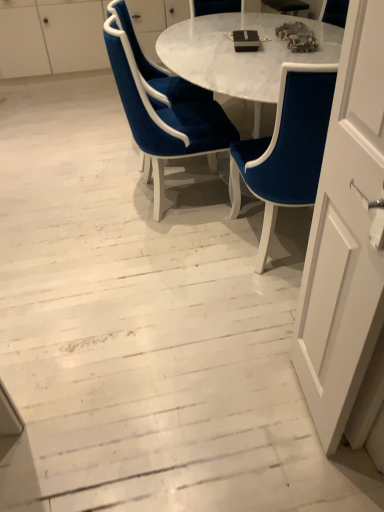
Describe the element at coordinates (286, 148) in the screenshot. Image resolution: width=384 pixels, height=512 pixels. I see `velvet blue chair at center, the 3th chair from the left` at that location.

What do you see at coordinates (164, 117) in the screenshot? I see `velvet blue chair at center, acting as the 2th chair starting from the right` at bounding box center [164, 117].

What is the approximate height of velvet blue chair at center, which appears as the 2th chair when viewed from the left?

36.64 inches.

Identify the location of velvet blue chair at center, the 3th chair from the left. The image size is (384, 512). (286, 148).

Image resolution: width=384 pixels, height=512 pixels. In order to click on dresser above the velvet blue chair at center, the first chair positioned from the left (from the image's perspective) in this screenshot , I will do `click(51, 37)`.

In terms of size, does white glossy dresser at upper center appear bigger or smaller than velvet blue chair at center, arranged as the 3th chair when viewed from the right?

white glossy dresser at upper center is bigger than velvet blue chair at center, arranged as the 3th chair when viewed from the right.

From a real-world perspective, is white glossy dresser at upper center physically above velvet blue chair at center, the first chair positioned from the left?

No, from a real-world perspective, white glossy dresser at upper center is not over velvet blue chair at center, the first chair positioned from the left

Is white glossy dresser at upper center with velvet blue chair at center, arranged as the 3th chair when viewed from the right?

No, white glossy dresser at upper center is not beside velvet blue chair at center, arranged as the 3th chair when viewed from the right.

Considering the positions of point (293, 150) and point (68, 44), is point (293, 150) closer or farther from the camera than point (68, 44)?

Point (293, 150).

From the image's perspective, which object appears higher, velvet blue chair at center, the 3th chair from the left, or white glossy dresser at upper center?

white glossy dresser at upper center, from the image's perspective.

Does velvet blue chair at center, the 3th chair from the left, touch white glossy dresser at upper center?

They are not placed beside each other.

From the image's perspective, which is below, velvet blue chair at center, the first chair positioned from the left, or velvet blue chair at center, which is the 1th chair from right to left?

From the image's view, velvet blue chair at center, which is the 1th chair from right to left, is below.

Is velvet blue chair at center, arranged as the 3th chair when viewed from the right, facing towards velvet blue chair at center, the 3th chair from the left?

No, velvet blue chair at center, arranged as the 3th chair when viewed from the right, is not aimed at velvet blue chair at center, the 3th chair from the left.

From a real-world perspective, is velvet blue chair at center, the first chair positioned from the left, physically located above or below velvet blue chair at center, the 3th chair from the left?

From a real-world perspective, velvet blue chair at center, the first chair positioned from the left, is physically below velvet blue chair at center, the 3th chair from the left.

Considering the relative positions of velvet blue chair at center, arranged as the 3th chair when viewed from the right, and velvet blue chair at center, which is the 1th chair from right to left, in the image provided, is velvet blue chair at center, arranged as the 3th chair when viewed from the right, in front of velvet blue chair at center, which is the 1th chair from right to left,?

No, the depth of velvet blue chair at center, arranged as the 3th chair when viewed from the right, is greater than that of velvet blue chair at center, which is the 1th chair from right to left.

Would you say velvet blue chair at center, which is the 1th chair from right to left, is a long distance from velvet blue chair at center, which appears as the 2th chair when viewed from the left?

That's not correct — velvet blue chair at center, which is the 1th chair from right to left, is a little close to velvet blue chair at center, which appears as the 2th chair when viewed from the left.

From a real-world perspective, relative to velvet blue chair at center, which appears as the 2th chair when viewed from the left, is velvet blue chair at center, the 3th chair from the left, vertically above or below?

velvet blue chair at center, the 3th chair from the left, is situated lower than velvet blue chair at center, which appears as the 2th chair when viewed from the left, in the real world.

Which is nearer, (249, 169) or (238, 138)?

The point (249, 169) is closer.

Between velvet blue chair at center, the 3th chair from the left, and velvet blue chair at center, acting as the 2th chair starting from the right, which one appears on the left side from the viewer's perspective?

velvet blue chair at center, acting as the 2th chair starting from the right.

Can you confirm if velvet blue chair at center, which appears as the 2th chair when viewed from the left, is positioned to the right of velvet blue chair at center, which is the 1th chair from right to left?

Incorrect, velvet blue chair at center, which appears as the 2th chair when viewed from the left, is not on the right side of velvet blue chair at center, which is the 1th chair from right to left.

Which of these two, velvet blue chair at center, which appears as the 2th chair when viewed from the left, or velvet blue chair at center, which is the 1th chair from right to left, stands taller?

velvet blue chair at center, which appears as the 2th chair when viewed from the left.

Is velvet blue chair at center, acting as the 2th chair starting from the right, looking in the opposite direction of velvet blue chair at center, the 3th chair from the left?

No, velvet blue chair at center, the 3th chair from the left, is not at the back of velvet blue chair at center, acting as the 2th chair starting from the right.

Does velvet blue chair at center, which appears as the 2th chair when viewed from the left, contain velvet blue chair at center, which is the 1th chair from right to left?

No.

In the scene shown: Considering the relative sizes of velvet blue chair at center, which appears as the 2th chair when viewed from the left, and white glossy dresser at upper center in the image provided, is velvet blue chair at center, which appears as the 2th chair when viewed from the left, thinner than white glossy dresser at upper center?

In fact, velvet blue chair at center, which appears as the 2th chair when viewed from the left, might be wider than white glossy dresser at upper center.

Is velvet blue chair at center, acting as the 2th chair starting from the right, taller or shorter than white glossy dresser at upper center?

velvet blue chair at center, acting as the 2th chair starting from the right, is taller than white glossy dresser at upper center.

Which of these two, velvet blue chair at center, which appears as the 2th chair when viewed from the left, or white glossy dresser at upper center, is bigger?

white glossy dresser at upper center.

From the image's perspective, is velvet blue chair at center, acting as the 2th chair starting from the right, located above or below white glossy dresser at upper center?

Clearly, from the image's perspective, velvet blue chair at center, acting as the 2th chair starting from the right, is below white glossy dresser at upper center.

Relative to velvet blue chair at center, the 3th chair from the left, is white glossy dresser at upper center in front or behind?

white glossy dresser at upper center is positioned farther from the viewer than velvet blue chair at center, the 3th chair from the left.

Is white glossy dresser at upper center located outside velvet blue chair at center, the 3th chair from the left?

Indeed, white glossy dresser at upper center is completely outside velvet blue chair at center, the 3th chair from the left.

Does white glossy dresser at upper center have a larger size compared to velvet blue chair at center, which is the 1th chair from right to left?

Yes, white glossy dresser at upper center is bigger than velvet blue chair at center, which is the 1th chair from right to left.

Find the location of a particular element. This screenshot has height=512, width=384. the 1st chair counting from the right of the white glossy dresser at upper center is located at coordinates (156, 68).

In the image, there is a velvet blue chair at center, the 3th chair from the left. Where is `dresser below it (from a real-world perspective)`? This screenshot has width=384, height=512. dresser below it (from a real-world perspective) is located at coordinates (51, 37).

From the image, which object appears to be farther from velvet blue chair at center, the first chair positioned from the left, velvet blue chair at center, which appears as the 2th chair when viewed from the left, or velvet blue chair at center, the 3th chair from the left?

velvet blue chair at center, the 3th chair from the left, is positioned further to the anchor velvet blue chair at center, the first chair positioned from the left.

Based on their spatial positions, is velvet blue chair at center, arranged as the 3th chair when viewed from the right, or velvet blue chair at center, which is the 1th chair from right to left, closer to white glossy dresser at upper center?

velvet blue chair at center, arranged as the 3th chair when viewed from the right.

When comparing their distances from velvet blue chair at center, which is the 1th chair from right to left, does velvet blue chair at center, the first chair positioned from the left, or white glossy dresser at upper center seem further?

Based on the image, white glossy dresser at upper center appears to be further to velvet blue chair at center, which is the 1th chair from right to left.

From the image, which object appears to be nearer to velvet blue chair at center, arranged as the 3th chair when viewed from the right, white glossy dresser at upper center or velvet blue chair at center, the 3th chair from the left?

velvet blue chair at center, the 3th chair from the left.

Based on their spatial positions, is velvet blue chair at center, acting as the 2th chair starting from the right, or white glossy dresser at upper center closer to velvet blue chair at center, which is the 1th chair from right to left?

Based on the image, velvet blue chair at center, acting as the 2th chair starting from the right, appears to be nearer to velvet blue chair at center, which is the 1th chair from right to left.

Based on their spatial positions, is white glossy dresser at upper center or velvet blue chair at center, arranged as the 3th chair when viewed from the right, closer to velvet blue chair at center, acting as the 2th chair starting from the right?

velvet blue chair at center, arranged as the 3th chair when viewed from the right.

Based on their spatial positions, is velvet blue chair at center, arranged as the 3th chair when viewed from the right, or white glossy dresser at upper center closer to velvet blue chair at center, which appears as the 2th chair when viewed from the left?

Among the two, velvet blue chair at center, arranged as the 3th chair when viewed from the right, is located nearer to velvet blue chair at center, which appears as the 2th chair when viewed from the left.

Which object lies further to the anchor point velvet blue chair at center, the first chair positioned from the left, velvet blue chair at center, which is the 1th chair from right to left, or velvet blue chair at center, acting as the 2th chair starting from the right?

velvet blue chair at center, which is the 1th chair from right to left.

Where is `chair positioned between velvet blue chair at center, which is the 1th chair from right to left, and velvet blue chair at center, arranged as the 3th chair when viewed from the right, from near to far`? This screenshot has height=512, width=384. chair positioned between velvet blue chair at center, which is the 1th chair from right to left, and velvet blue chair at center, arranged as the 3th chair when viewed from the right, from near to far is located at coordinates (164, 117).

The image size is (384, 512). Find the location of `chair between velvet blue chair at center, acting as the 2th chair starting from the right, and white glossy dresser at upper center in the front-back direction`. chair between velvet blue chair at center, acting as the 2th chair starting from the right, and white glossy dresser at upper center in the front-back direction is located at coordinates (156, 68).